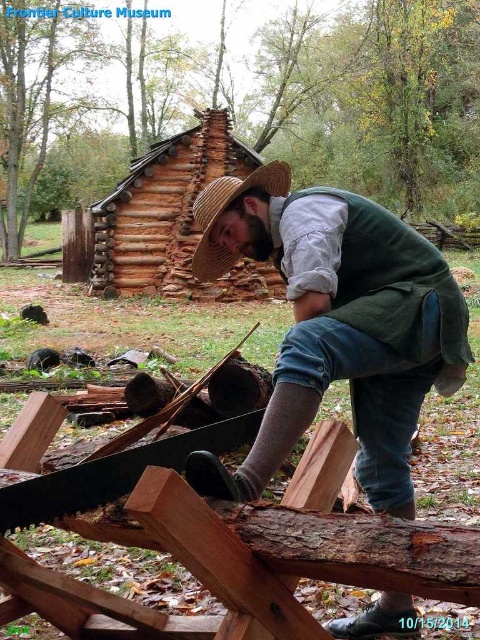
Is green woolen vest at center above strawmaterial/texturehat at center?

No, green woolen vest at center is not above strawmaterial/texturehat at center.

Is green woolen vest at center wider than strawmaterial/texturehat at center?

In fact, green woolen vest at center might be narrower than strawmaterial/texturehat at center.

Find the location of a particular element. This screenshot has width=480, height=640. green woolen vest at center is located at coordinates (336, 324).

At what (x,y) coordinates should I click in order to perform the action: click on green woolen vest at center. Please return your answer as a coordinate pair (x, y). This screenshot has width=480, height=640. Looking at the image, I should click on (336, 324).